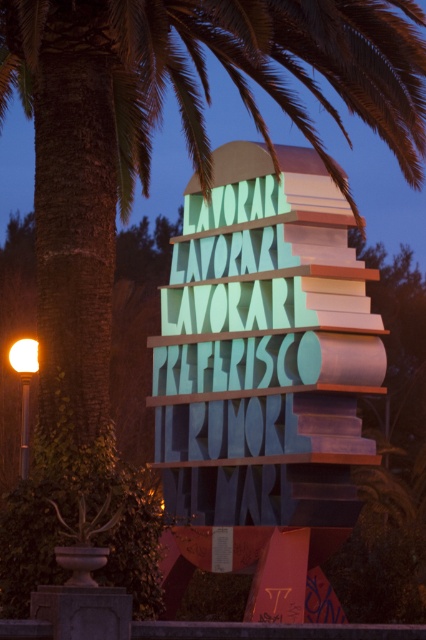
You are an artist standing at the base of the installation. You notice two points marked on the structure. The first point is at coordinate point (342, 496), and the second is at point (23, 356). If you want to paint the point that is closer to you, which coordinate should you aim for?

Point (342, 496) is in front of point (23, 356), so you should aim for point (342, 496) as it is closer to you.

You are an artist planning to photograph the multicolored plastic sign at center and the matte yellow light at left for an exhibition catalog. Which object should you focus on first to ensure the larger one is captured prominently?

The multicolored plastic sign at center should be focused on first since it has a larger size compared to the matte yellow light at left, ensuring it is prominently displayed in the photograph.